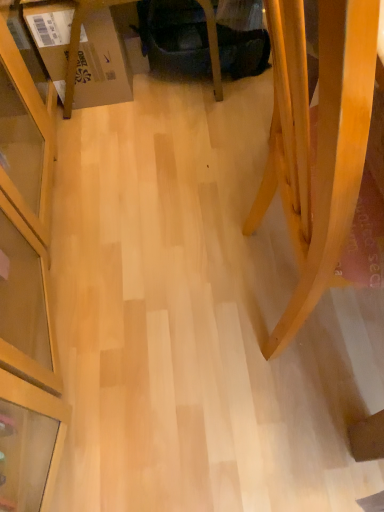
Question: Is velvet dark blue swivel chair at center not close to cardboard box at left?

Choices:
 (A) yes
 (B) no

Answer: (B)

Question: Considering the relative sizes of velvet dark blue swivel chair at center and cardboard box at left in the image provided, is velvet dark blue swivel chair at center taller than cardboard box at left?

Choices:
 (A) no
 (B) yes

Answer: (A)

Question: Can you confirm if velvet dark blue swivel chair at center is positioned to the right of cardboard box at left?

Choices:
 (A) yes
 (B) no

Answer: (A)

Question: From the image's perspective, is velvet dark blue swivel chair at center below cardboard box at left?

Choices:
 (A) yes
 (B) no

Answer: (B)

Question: Does velvet dark blue swivel chair at center come behind cardboard box at left?

Choices:
 (A) no
 (B) yes

Answer: (B)

Question: Is cardboard box at left in front of or behind light wood chair at lower right in the image?

Choices:
 (A) behind
 (B) front

Answer: (A)

Question: Do you think cardboard box at left is within light wood chair at lower right, or outside of it?

Choices:
 (A) inside
 (B) outside

Answer: (B)

Question: Considering the positions of cardboard box at left and light wood chair at lower right in the image, is cardboard box at left taller or shorter than light wood chair at lower right?

Choices:
 (A) tall
 (B) short

Answer: (B)

Question: In the image, is cardboard box at left on the left side or the right side of light wood chair at lower right?

Choices:
 (A) right
 (B) left

Answer: (B)

Question: Is cardboard box at left to the left or to the right of velvet dark blue swivel chair at center in the image?

Choices:
 (A) right
 (B) left

Answer: (B)

Question: From a real-world perspective, is cardboard box at left positioned above or below velvet dark blue swivel chair at center?

Choices:
 (A) above
 (B) below

Answer: (A)

Question: From the image's perspective, relative to velvet dark blue swivel chair at center, is cardboard box at left above or below?

Choices:
 (A) above
 (B) below

Answer: (B)

Question: In terms of width, does cardboard box at left look wider or thinner when compared to velvet dark blue swivel chair at center?

Choices:
 (A) wide
 (B) thin

Answer: (B)

Question: Is light wood chair at lower right wider or thinner than velvet dark blue swivel chair at center?

Choices:
 (A) wide
 (B) thin

Answer: (A)

Question: Looking at the image, does light wood chair at lower right seem bigger or smaller compared to velvet dark blue swivel chair at center?

Choices:
 (A) small
 (B) big

Answer: (B)